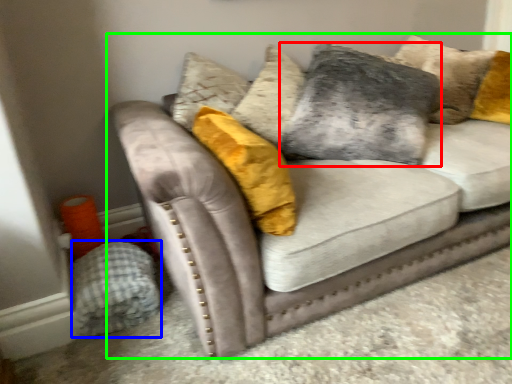
Question: Which object is positioned closest to pillow (highlighted by a red box)? Select from material (highlighted by a blue box) and studio couch (highlighted by a green box).

Choices:
 (A) material
 (B) studio couch

Answer: (B)